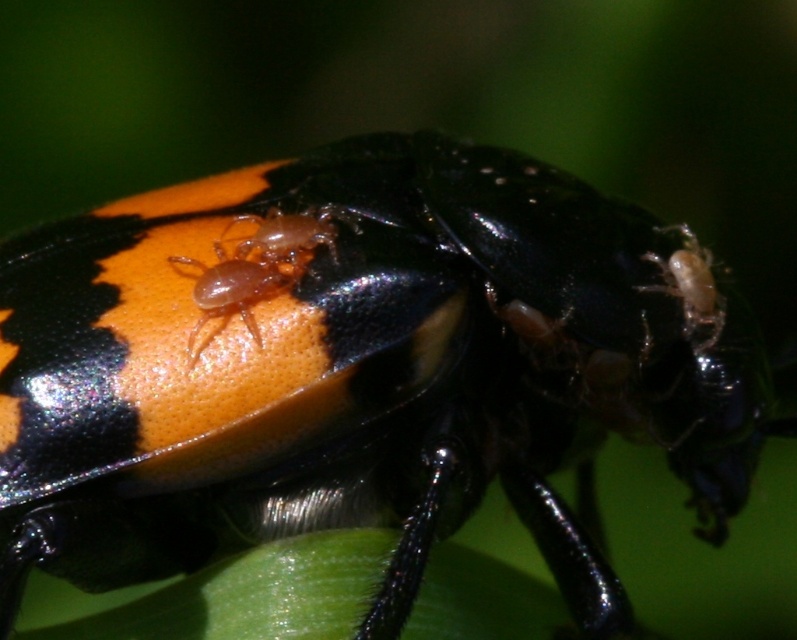
Question: Where is translucent orange spider at center located in relation to translucent beige spider at upper right in the image?

Choices:
 (A) right
 (B) left

Answer: (B)

Question: Which point is closer to the camera?

Choices:
 (A) (248, 282)
 (B) (686, 321)

Answer: (A)

Question: Among these objects, which one is farthest from the camera?

Choices:
 (A) translucent orange spider at center
 (B) translucent beige spider at upper right

Answer: (B)

Question: Is translucent orange spider at center behind translucent beige spider at upper right?

Choices:
 (A) no
 (B) yes

Answer: (A)

Question: Does translucent orange spider at center have a greater width compared to translucent beige spider at upper right?

Choices:
 (A) no
 (B) yes

Answer: (B)